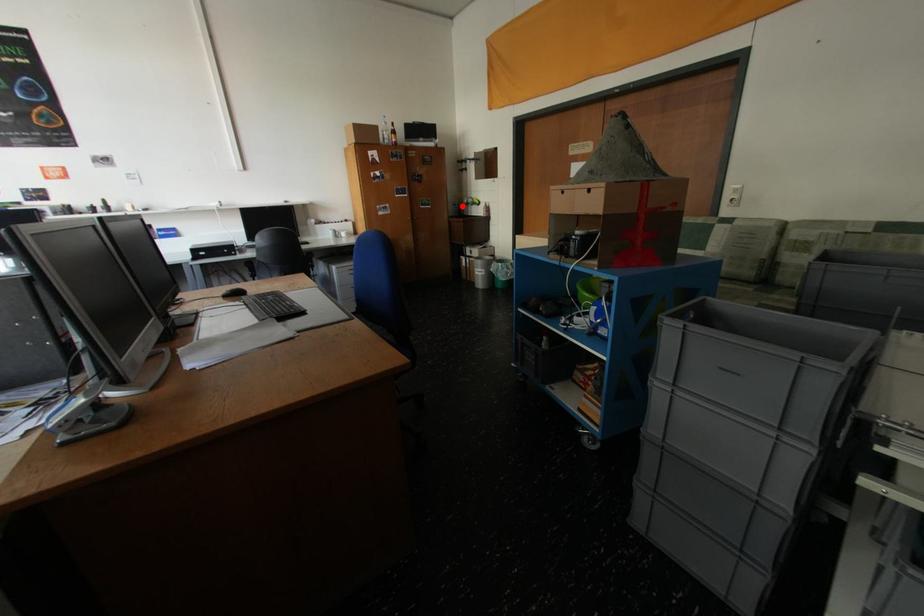
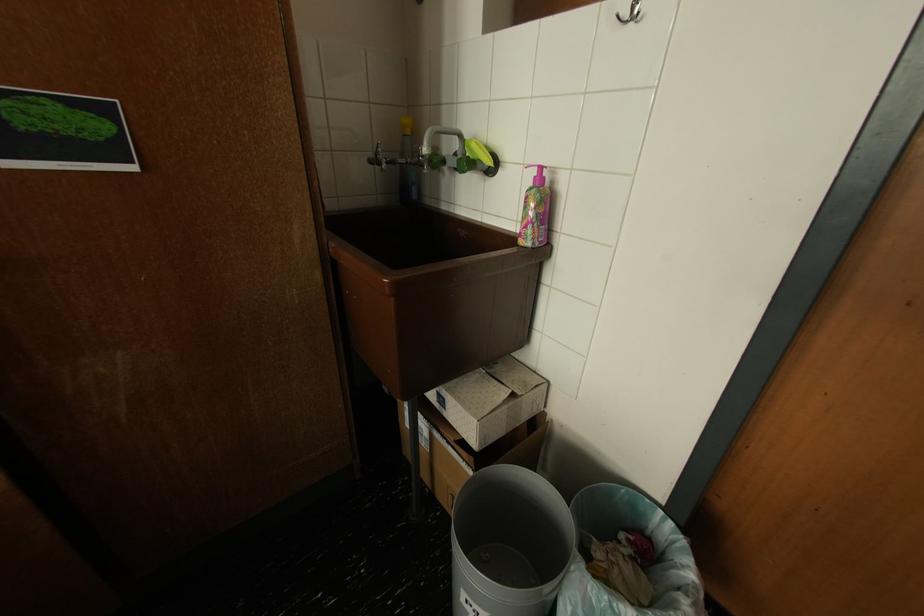
Question: I am providing you with two images of the same scene from different viewpoints. In image1, a red point is highlighted. Considering the same 3D point in image2, which of the following is correct?

Choices:
 (A) It is closer
 (B) It is farther

Answer: (B)